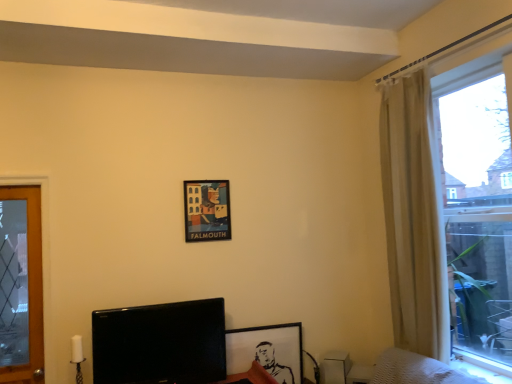
Question: From the image's perspective, does black glossy tv at lower left appear higher than matte paper poster at center, which is the second picture frame from bottom to top?

Choices:
 (A) no
 (B) yes

Answer: (A)

Question: Is black glossy tv at lower left smaller than matte paper poster at center, the first picture frame in the left-to-right sequence?

Choices:
 (A) yes
 (B) no

Answer: (B)

Question: From a real-world perspective, is black glossy tv at lower left over matte paper poster at center, which is the second picture frame from bottom to top?

Choices:
 (A) yes
 (B) no

Answer: (B)

Question: Is black glossy tv at lower left positioned far away from matte paper poster at center, the 2th picture frame from the right?

Choices:
 (A) no
 (B) yes

Answer: (A)

Question: Is black glossy tv at lower left turned away from matte paper poster at center, which is the second picture frame from bottom to top?

Choices:
 (A) yes
 (B) no

Answer: (B)

Question: Based on their sizes in the image, would you say black glossy tv at lower left is bigger or smaller than beige fabric curtain at right?

Choices:
 (A) big
 (B) small

Answer: (B)

Question: Would you say black glossy tv at lower left is to the left or to the right of beige fabric curtain at right in the picture?

Choices:
 (A) right
 (B) left

Answer: (B)

Question: Is black glossy tv at lower left taller or shorter than beige fabric curtain at right?

Choices:
 (A) short
 (B) tall

Answer: (A)

Question: From the image's perspective, relative to beige fabric curtain at right, is black glossy tv at lower left above or below?

Choices:
 (A) above
 (B) below

Answer: (B)

Question: In terms of width, does matte paper poster at center, the first picture frame viewed from the top, look wider or thinner when compared to black matte picture frame at lower center, the first picture frame in the right-to-left sequence?

Choices:
 (A) thin
 (B) wide

Answer: (A)

Question: From a real-world perspective, is matte paper poster at center, the first picture frame in the left-to-right sequence, positioned above or below black matte picture frame at lower center, which is the second picture frame in left-to-right order?

Choices:
 (A) below
 (B) above

Answer: (B)

Question: Is matte paper poster at center, the 2th picture frame from the right, bigger or smaller than black matte picture frame at lower center, the first picture frame in the right-to-left sequence?

Choices:
 (A) big
 (B) small

Answer: (B)

Question: Is matte paper poster at center, the first picture frame in the left-to-right sequence, inside the boundaries of black matte picture frame at lower center, the first picture frame in the right-to-left sequence, or outside?

Choices:
 (A) outside
 (B) inside

Answer: (A)

Question: From a real-world perspective, relative to black glossy tv at lower left, is translucent glass window at right vertically above or below?

Choices:
 (A) below
 (B) above

Answer: (B)

Question: Is translucent glass window at right wider or thinner than black glossy tv at lower left?

Choices:
 (A) thin
 (B) wide

Answer: (B)